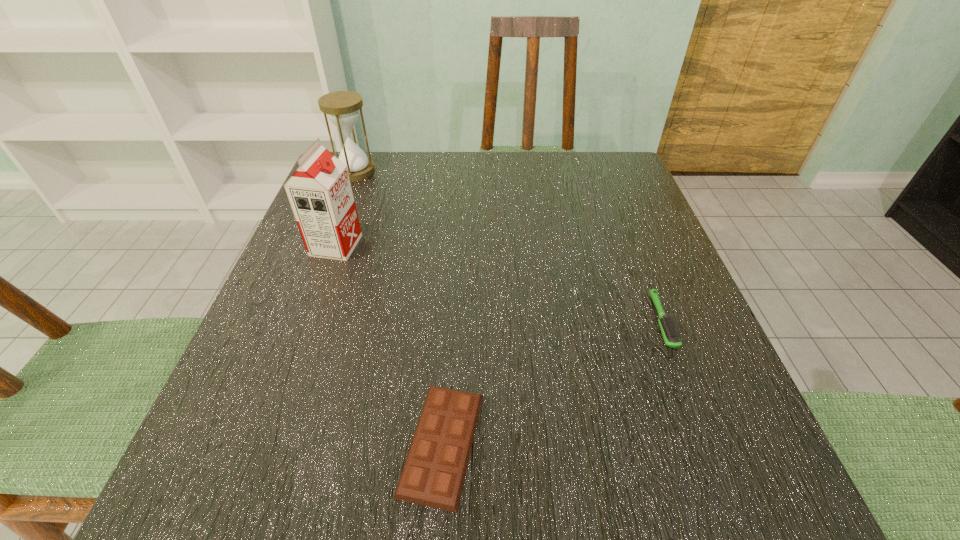
The image size is (960, 540). Identify the location of vacant region between the third farthest object and the farthest object. (509, 246).

This screenshot has height=540, width=960. Find the location of `empty location between the second nearest object and the second farthest object`. empty location between the second nearest object and the second farthest object is located at coordinates (499, 283).

The height and width of the screenshot is (540, 960). I want to click on the second closest object to the hairbrush, so click(320, 194).

Identify which object is the nearest to the shortest object. Please provide its 2D coordinates. Your answer should be formatted as a tuple, i.e. [(x, y)], where the tuple contains the x and y coordinates of a point satisfying the conditions above.

[(671, 334)]

Where is `vacant area that satisfies the following two spatial constraints: 1. on the front side of the second object from right to left; 2. on the right side of the hourglass`? The width and height of the screenshot is (960, 540). vacant area that satisfies the following two spatial constraints: 1. on the front side of the second object from right to left; 2. on the right side of the hourglass is located at coordinates (250, 443).

Locate an element on the screen. The image size is (960, 540). vacant space that satisfies the following two spatial constraints: 1. on the front side of the shortest object; 2. on the right side of the second tallest object is located at coordinates (250, 443).